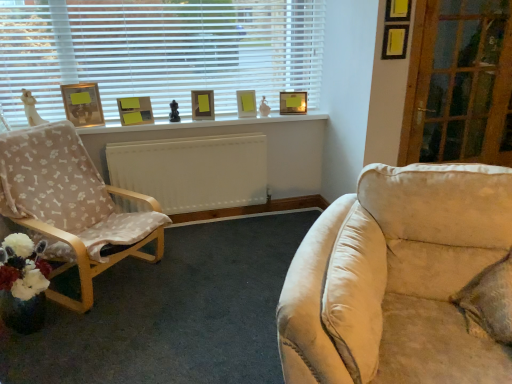
Question: Is white plastic blinds at upper left oriented towards white painted wood at upper center?

Choices:
 (A) yes
 (B) no

Answer: (B)

Question: Considering the relative sizes of white plastic blinds at upper left and white painted wood at upper center in the image provided, is white plastic blinds at upper left taller than white painted wood at upper center?

Choices:
 (A) yes
 (B) no

Answer: (A)

Question: Are white plastic blinds at upper left and white painted wood at upper center located far from each other?

Choices:
 (A) yes
 (B) no

Answer: (B)

Question: Is white plastic blinds at upper left looking in the opposite direction of white painted wood at upper center?

Choices:
 (A) no
 (B) yes

Answer: (A)

Question: Can you confirm if white plastic blinds at upper left is shorter than white painted wood at upper center?

Choices:
 (A) yes
 (B) no

Answer: (B)

Question: In terms of size, does beige fabric chair at left appear bigger or smaller than green textured pillow at lower right?

Choices:
 (A) small
 (B) big

Answer: (B)

Question: Is beige fabric chair at left in front of or behind green textured pillow at lower right in the image?

Choices:
 (A) behind
 (B) front

Answer: (A)

Question: From a real-world perspective, is beige fabric chair at left positioned above or below green textured pillow at lower right?

Choices:
 (A) above
 (B) below

Answer: (B)

Question: Is beige fabric chair at left situated inside green textured pillow at lower right or outside?

Choices:
 (A) inside
 (B) outside

Answer: (B)

Question: From a real-world perspective, relative to gold metallic picture frame at upper left, the fifth picture frame from the right, is matte wooden picture frame at center, which ranks as the 2th picture frame in left-to-right order, vertically above or below?

Choices:
 (A) above
 (B) below

Answer: (B)

Question: From the image's perspective, is matte wooden picture frame at center, which ranks as the 2th picture frame in left-to-right order, positioned above or below gold metallic picture frame at upper left, placed as the 1th picture frame when sorted from left to right?

Choices:
 (A) above
 (B) below

Answer: (B)

Question: Considering their positions, is matte wooden picture frame at center, the 4th picture frame positioned from the right, located in front of or behind gold metallic picture frame at upper left, placed as the 1th picture frame when sorted from left to right?

Choices:
 (A) front
 (B) behind

Answer: (B)

Question: Is matte wooden picture frame at center, the 4th picture frame positioned from the right, taller or shorter than gold metallic picture frame at upper left, the fifth picture frame from the right?

Choices:
 (A) tall
 (B) short

Answer: (B)

Question: Does point (300, 96) appear closer or farther from the camera than point (15, 76)?

Choices:
 (A) farther
 (B) closer

Answer: (A)

Question: Considering their positions, is matte wooden picture frame at upper center, the 5th picture frame positioned from the left, located in front of or behind white plastic blinds at upper left?

Choices:
 (A) behind
 (B) front

Answer: (A)